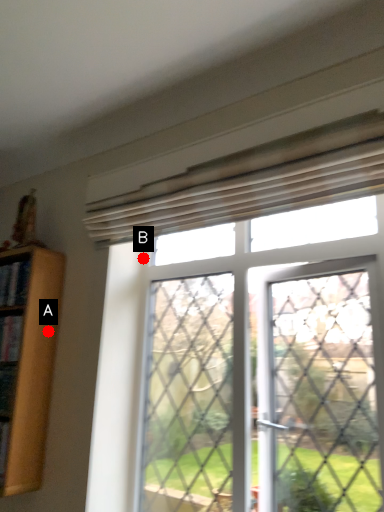
Question: Two points are circled on the image, labeled by A and B beside each circle. Which point appears closest to the camera in this image?

Choices:
 (A) A is closer
 (B) B is closer

Answer: (A)